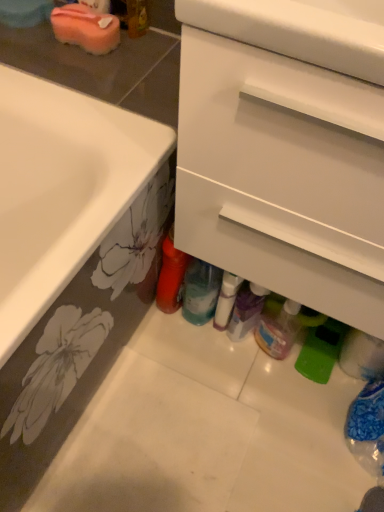
Question: In terms of width, does white glossy bottle at center, placed as the 2th bottle when sorted from right to left, look wider or thinner when compared to translucent plastic bottle at lower center, the third bottle when ordered from right to left?

Choices:
 (A) thin
 (B) wide

Answer: (A)

Question: Looking at the image, does white glossy bottle at center, placed as the 2th bottle when sorted from right to left, seem bigger or smaller compared to translucent plastic bottle at lower center, the third bottle when ordered from right to left?

Choices:
 (A) big
 (B) small

Answer: (B)

Question: Which of these objects is positioned closest to the translucent plastic bottle at lower center, the third bottle when ordered from right to left?

Choices:
 (A) translucent plastic bottle at center, which is the fourth bottle in right-to-left order
 (B) translucent plastic bottles at lower center
 (C) translucent plastic bottle at lower center, which is counted as the first bottle, starting from the right
 (D) white matte drawer at center
 (E) white glossy bottle at center, which ranks as the 3th bottle in left-to-right order

Answer: (E)

Question: Which object is positioned farthest from the white matte drawer at center?

Choices:
 (A) translucent plastic bottle at lower center, the third bottle when ordered from right to left
 (B) translucent plastic bottle at lower center, which is counted as the first bottle, starting from the right
 (C) white glossy bottle at center, which ranks as the 3th bottle in left-to-right order
 (D) pink sponge at upper left
 (E) translucent plastic bottle at center, which is the fourth bottle in right-to-left order

Answer: (B)